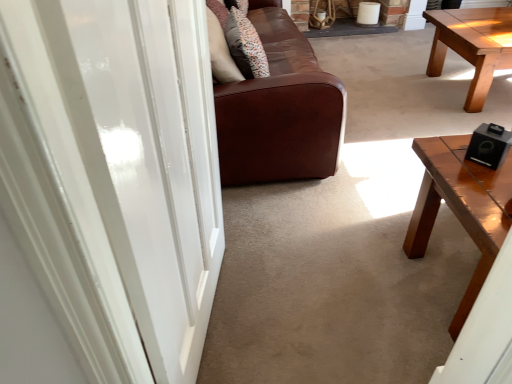
The image size is (512, 384). In order to click on free space between shiny brown wood coffee table at right and white glossy door at center in this screenshot , I will do `click(329, 301)`.